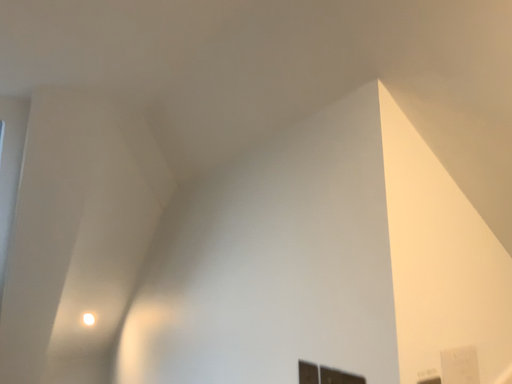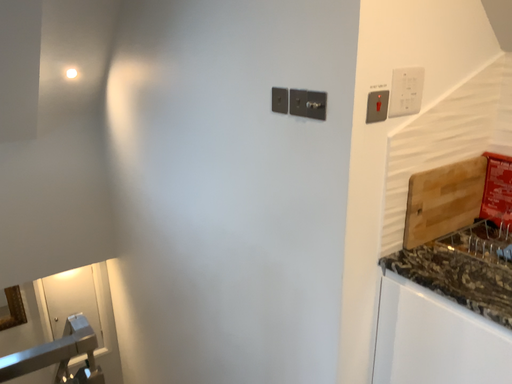
Question: Which way did the camera rotate in the video?

Choices:
 (A) rotated upward
 (B) rotated downward

Answer: (B)